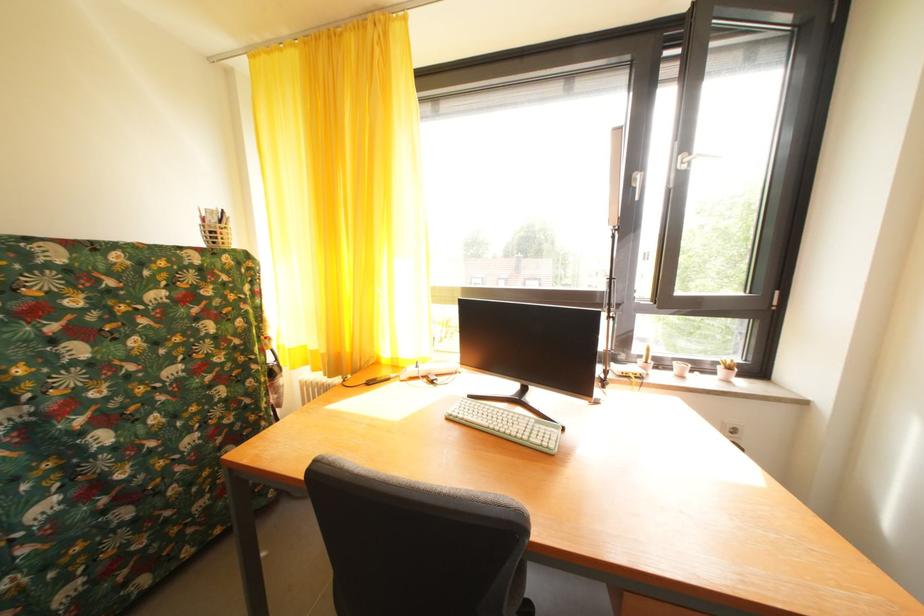
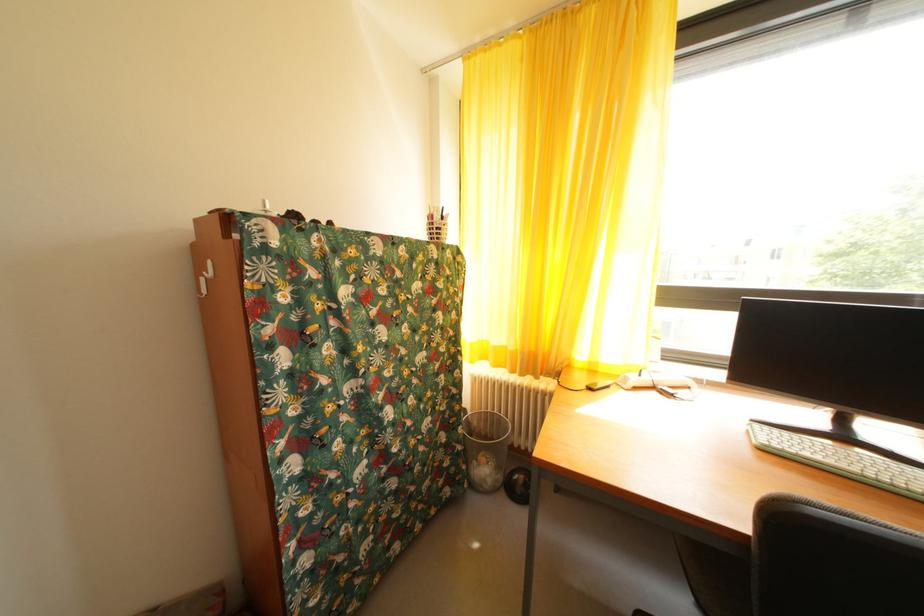
Find the pixel in the second image that matches the point at 492,429 in the first image.

(854, 472)